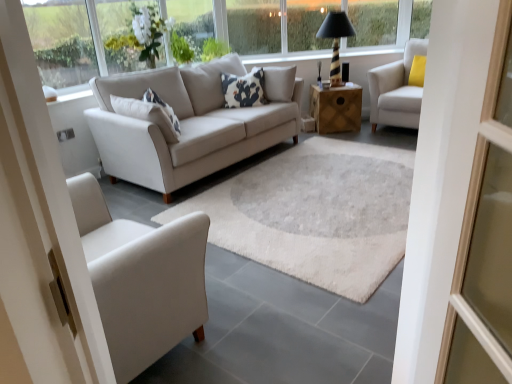
Question: Can you confirm if white fabric armchair at upper right is shorter than wooden side table at center?

Choices:
 (A) no
 (B) yes

Answer: (A)

Question: Can you confirm if white fabric armchair at upper right is bigger than wooden side table at center?

Choices:
 (A) no
 (B) yes

Answer: (B)

Question: Considering the relative positions of white fabric armchair at upper right and wooden side table at center in the image provided, is white fabric armchair at upper right to the right of wooden side table at center from the viewer's perspective?

Choices:
 (A) yes
 (B) no

Answer: (A)

Question: Is wooden side table at center at the back of white fabric armchair at upper right?

Choices:
 (A) no
 (B) yes

Answer: (A)

Question: Could you tell me if white fabric armchair at upper right is facing wooden side table at center?

Choices:
 (A) yes
 (B) no

Answer: (B)

Question: From the image's perspective, is black striped lamp at upper right positioned above or below white fabric armchair at upper right?

Choices:
 (A) below
 (B) above

Answer: (B)

Question: Based on their sizes in the image, would you say black striped lamp at upper right is bigger or smaller than white fabric armchair at upper right?

Choices:
 (A) small
 (B) big

Answer: (A)

Question: In terms of width, does black striped lamp at upper right look wider or thinner when compared to white fabric armchair at upper right?

Choices:
 (A) wide
 (B) thin

Answer: (B)

Question: Visually, is black striped lamp at upper right positioned to the left or to the right of white fabric armchair at upper right?

Choices:
 (A) right
 (B) left

Answer: (B)

Question: Is transparent glass window at upper center, the 6th window from the left, taller or shorter than black striped lamp at upper right?

Choices:
 (A) short
 (B) tall

Answer: (A)

Question: From a real-world perspective, is transparent glass window at upper center, the 6th window from the left, positioned above or below black striped lamp at upper right?

Choices:
 (A) above
 (B) below

Answer: (A)

Question: Is transparent glass window at upper center, the 6th window from the left, in front of or behind black striped lamp at upper right in the image?

Choices:
 (A) front
 (B) behind

Answer: (B)

Question: Do you think transparent glass window at upper center, the 6th window from the left, is within black striped lamp at upper right, or outside of it?

Choices:
 (A) inside
 (B) outside

Answer: (B)

Question: Is wooden side table at center inside or outside of white fabric armchair at upper right?

Choices:
 (A) outside
 (B) inside

Answer: (A)

Question: Is wooden side table at center wider or thinner than white fabric armchair at upper right?

Choices:
 (A) thin
 (B) wide

Answer: (A)